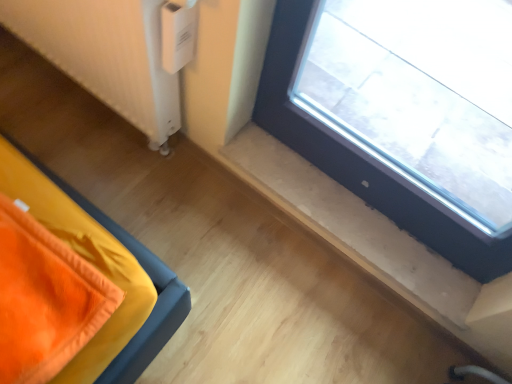
The image size is (512, 384). Describe the element at coordinates (106, 55) in the screenshot. I see `white plastic radiator at lower left` at that location.

Identify the location of white plastic radiator at lower left. This screenshot has width=512, height=384. (106, 55).

The width and height of the screenshot is (512, 384). Describe the element at coordinates (361, 158) in the screenshot. I see `transparent glass window at upper right` at that location.

This screenshot has width=512, height=384. In order to click on transparent glass window at upper right in this screenshot , I will do `click(361, 158)`.

You are a GUI agent. You are given a task and a screenshot of the screen. Output one action in this format:
    pyautogui.click(x=<x>, y=<y>)
    Task: Click on the white plastic radiator at lower left
    The width and height of the screenshot is (512, 384).
    Given the screenshot: What is the action you would take?
    pyautogui.click(x=106, y=55)

Which object is positioned more to the left, white plastic radiator at lower left or transparent glass window at upper right?

Positioned to the left is white plastic radiator at lower left.

Considering their positions, is white plastic radiator at lower left located in front of or behind transparent glass window at upper right?

Visually, white plastic radiator at lower left is located behind transparent glass window at upper right.

Which point is more distant from viewer, (163, 72) or (435, 244)?

The point (435, 244) is farther from the camera.

Looking at this image, from the image's perspective, between white plastic radiator at lower left and transparent glass window at upper right, which one is located above?

white plastic radiator at lower left appears higher in the image.

From a real-world perspective, is white plastic radiator at lower left on transparent glass window at upper right?

No, from a real-world perspective, white plastic radiator at lower left is not above transparent glass window at upper right.

Is white plastic radiator at lower left wider than transparent glass window at upper right?

Indeed, white plastic radiator at lower left has a greater width compared to transparent glass window at upper right.

Considering the relative sizes of white plastic radiator at lower left and transparent glass window at upper right in the image provided, is white plastic radiator at lower left taller than transparent glass window at upper right?

Incorrect, the height of white plastic radiator at lower left is not larger of that of transparent glass window at upper right.

Can you confirm if white plastic radiator at lower left is bigger than transparent glass window at upper right?

Correct, white plastic radiator at lower left is larger in size than transparent glass window at upper right.

Is white plastic radiator at lower left positioned beyond the bounds of transparent glass window at upper right?

Yes, white plastic radiator at lower left is located beyond the bounds of transparent glass window at upper right.

In the scene shown: Is white plastic radiator at lower left placed right next to transparent glass window at upper right?

No, white plastic radiator at lower left is not next to transparent glass window at upper right.

From the picture: Could you tell me if white plastic radiator at lower left is turned towards transparent glass window at upper right?

No, white plastic radiator at lower left is not oriented towards transparent glass window at upper right.

Locate an element on the screen. window that appears below the white plastic radiator at lower left (from the image's perspective) is located at coordinates (361, 158).

Considering the relative positions of transparent glass window at upper right and white plastic radiator at lower left in the image provided, is transparent glass window at upper right to the left or to the right of white plastic radiator at lower left?

transparent glass window at upper right is to the right of white plastic radiator at lower left.

Which is in front, transparent glass window at upper right or white plastic radiator at lower left?

Positioned in front is transparent glass window at upper right.

Which is closer, (298,26) or (74,62)?

The point (298,26) is closer to the camera.

From the image's perspective, would you say transparent glass window at upper right is shown under white plastic radiator at lower left?

Yes.

From a real-world perspective, is transparent glass window at upper right over white plastic radiator at lower left?

Yes, from a real-world perspective, transparent glass window at upper right is above white plastic radiator at lower left.

Is transparent glass window at upper right wider than white plastic radiator at lower left?

In fact, transparent glass window at upper right might be narrower than white plastic radiator at lower left.

In terms of height, does transparent glass window at upper right look taller or shorter compared to white plastic radiator at lower left?

Considering their sizes, transparent glass window at upper right has more height than white plastic radiator at lower left.

Is transparent glass window at upper right smaller than white plastic radiator at lower left?

Correct, transparent glass window at upper right occupies less space than white plastic radiator at lower left.

Choose the correct answer: Is transparent glass window at upper right inside white plastic radiator at lower left or outside it?

transparent glass window at upper right is located beyond the bounds of white plastic radiator at lower left.

Are transparent glass window at upper right and white plastic radiator at lower left making contact?

transparent glass window at upper right and white plastic radiator at lower left are clearly separated.

Is transparent glass window at upper right facing away from white plastic radiator at lower left?

No, transparent glass window at upper right's orientation is not away from white plastic radiator at lower left.

How many degrees apart are the facing directions of transparent glass window at upper right and white plastic radiator at lower left?

The facing directions of transparent glass window at upper right and white plastic radiator at lower left are 0.0399 degrees apart.

In the scene shown: How much distance is there between transparent glass window at upper right and white plastic radiator at lower left?

transparent glass window at upper right is 19.92 inches away from white plastic radiator at lower left.

Identify the location of radiator that is under the transparent glass window at upper right (from a real-world perspective). The height and width of the screenshot is (384, 512). (106, 55).

Find the location of a particular element. window below the white plastic radiator at lower left (from the image's perspective) is located at coordinates (361, 158).

Where is `window to the right of white plastic radiator at lower left`? The height and width of the screenshot is (384, 512). window to the right of white plastic radiator at lower left is located at coordinates (361, 158).